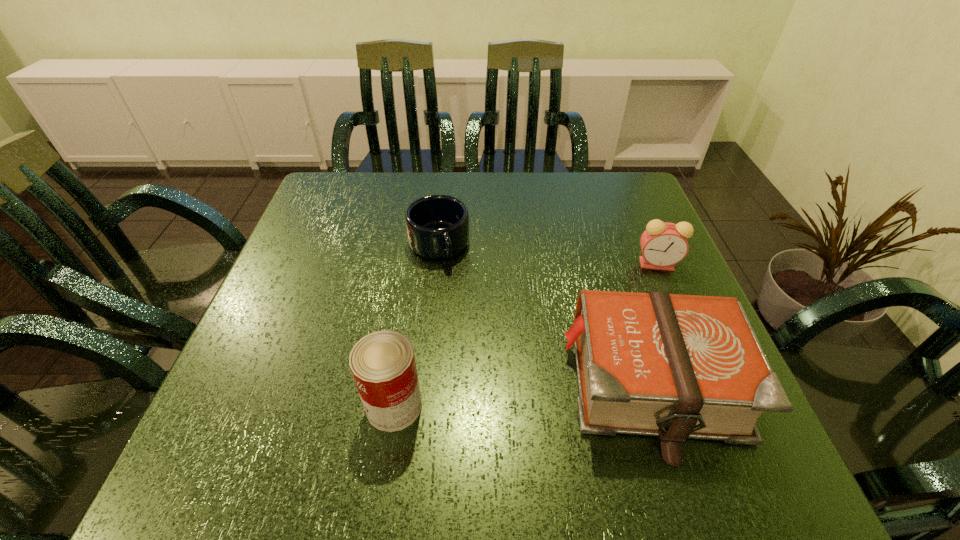
In the image, there is a desktop. What are the coordinates of `free space at the near edge` in the screenshot? It's located at (464, 413).

The width and height of the screenshot is (960, 540). In order to click on free region at the left edge of the desktop in this screenshot , I will do `click(253, 325)`.

The width and height of the screenshot is (960, 540). In the image, there is a desktop. In order to click on vacant space at the right edge in this screenshot , I will do `click(661, 283)`.

In order to click on free space at the far left corner in this screenshot , I will do `click(342, 187)`.

I want to click on free location at the near left corner of the desktop, so click(x=256, y=408).

Find the location of a particular element. vacant space at the far right corner is located at coordinates click(x=626, y=213).

Locate an element on the screen. free space between the alarm clock and the mug is located at coordinates (547, 254).

Where is `empty space between the mug and the can`? The height and width of the screenshot is (540, 960). empty space between the mug and the can is located at coordinates click(417, 325).

At what (x,y) coordinates should I click in order to perform the action: click on vacant space that's between the shortest object and the tallest object. Please return your answer as a coordinate pair (x, y). This screenshot has height=540, width=960. Looking at the image, I should click on (417, 325).

Image resolution: width=960 pixels, height=540 pixels. Find the location of `blank region between the Bible and the shortest object`. blank region between the Bible and the shortest object is located at coordinates (545, 315).